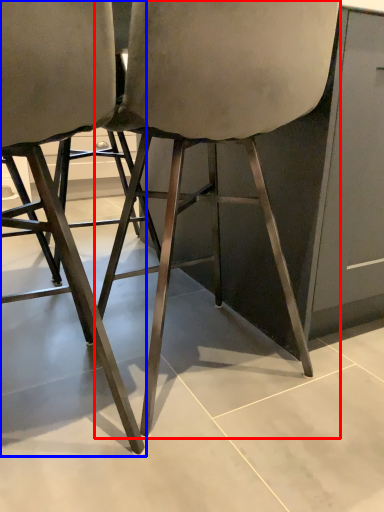
Question: Which object is closer to the camera taking this photo, chair (highlighted by a red box) or chair (highlighted by a blue box)?

Choices:
 (A) chair
 (B) chair

Answer: (B)